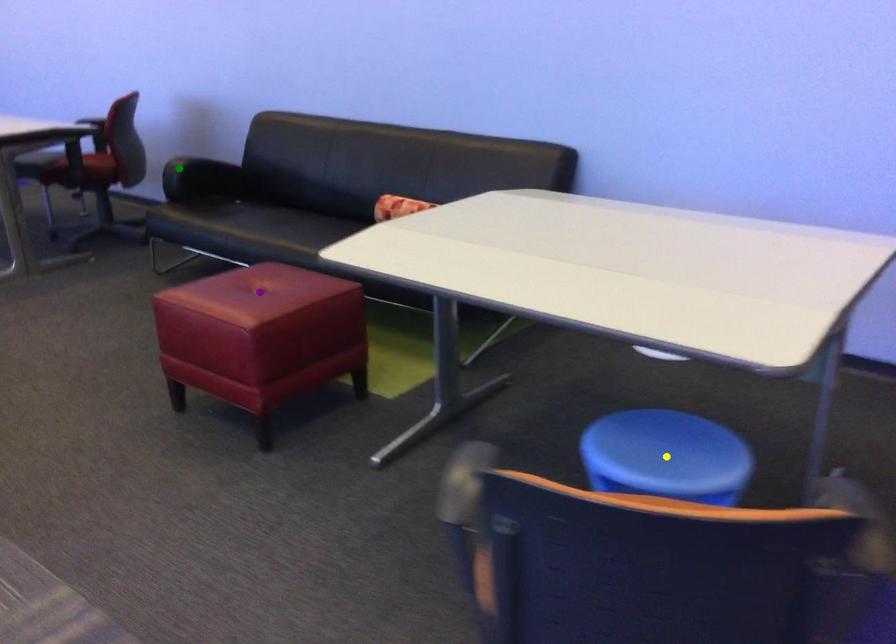
Order these from nearest to farthest:
1. purple point
2. green point
3. yellow point

green point
purple point
yellow point